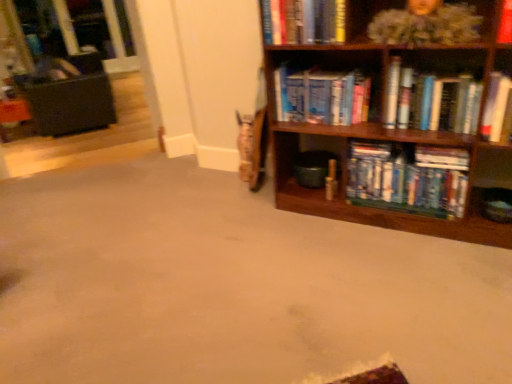
Identify the location of vacant space to the left of wooden bookcase at right. (249, 236).